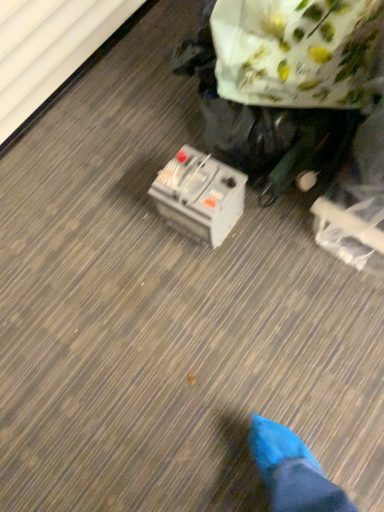
This screenshot has height=512, width=384. I want to click on vacant space positioned to the left of gray plastic battery at center, so click(x=139, y=229).